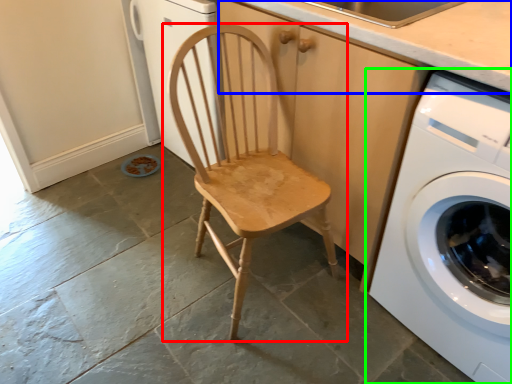
Question: Which object is positioned farthest from chair (highlighted by a red box)? Select from counter top (highlighted by a blue box) and washing machine (highlighted by a green box).

Choices:
 (A) counter top
 (B) washing machine

Answer: (A)